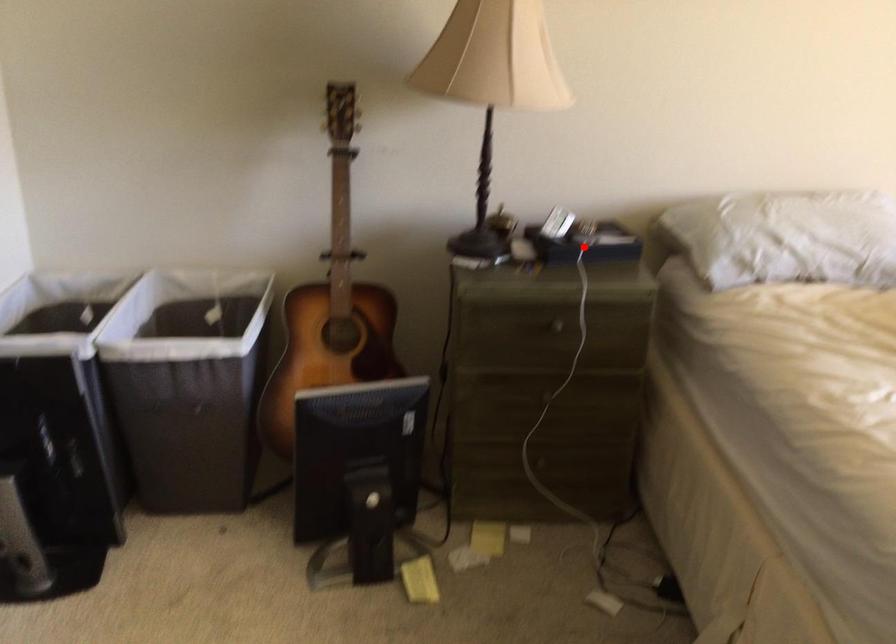
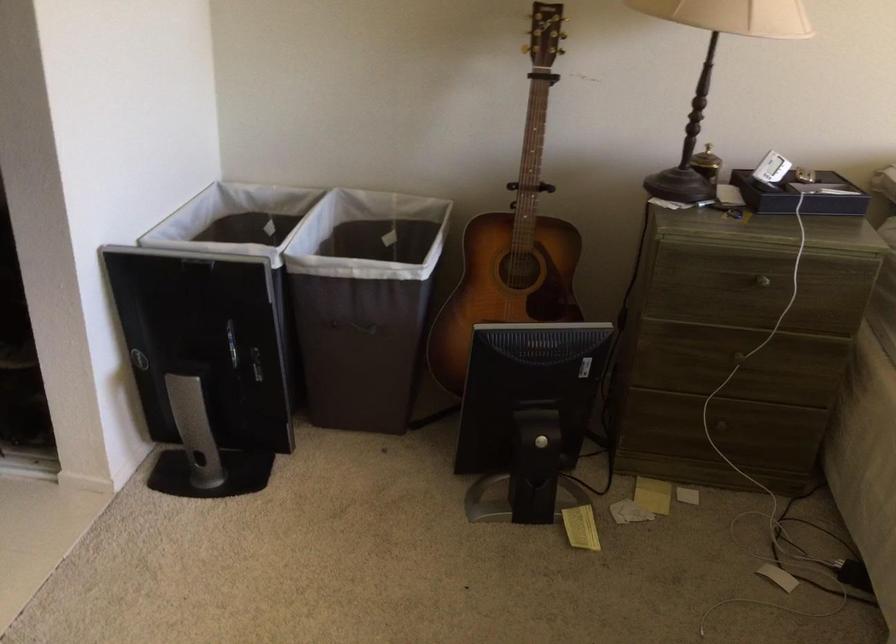
Question: I am providing you with two images of the same scene from different viewpoints. In image1, a red point is highlighted. Considering the same 3D point in image2, which of the following is correct?

Choices:
 (A) It is closer
 (B) It is farther

Answer: (A)